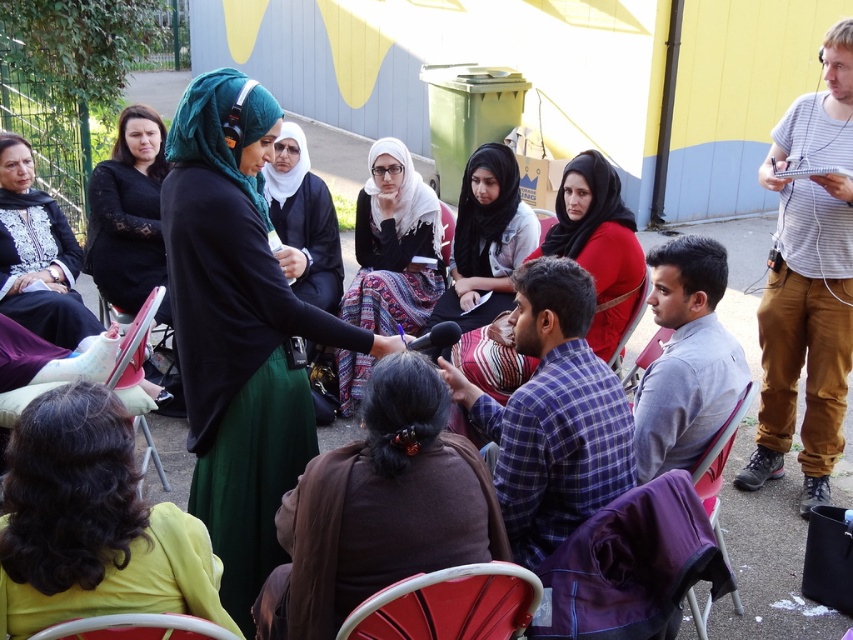
Is curly hair at lower left wider than red plastic chair at lower center?

Yes, curly hair at lower left is wider than red plastic chair at lower center.

Between point (112, 572) and point (373, 636), which one is positioned in front?

Point (112, 572)

This screenshot has width=853, height=640. In order to click on curly hair at lower left in this screenshot , I will do `click(91, 524)`.

Which is more to the left, black lace dress at center or plastic chair at lower left?

From the viewer's perspective, black lace dress at center appears more on the left side.

Is black lace dress at center wider than plastic chair at lower left?

Correct, the width of black lace dress at center exceeds that of plastic chair at lower left.

The image size is (853, 640). I want to click on black lace dress at center, so click(x=128, y=212).

Between patterned fabric hijab at center and red plastic chair at lower center, which one appears on the right side from the viewer's perspective?

red plastic chair at lower center

Is point (376, 243) closer to camera compared to point (366, 621)?

No, (376, 243) is behind (366, 621).

Is point (358, 195) positioned before point (439, 621)?

No, it is not.

You are a GUI agent. You are given a task and a screenshot of the screen. Output one action in this format:
    pyautogui.click(x=<x>, y=<y>)
    Task: Click on the patterned fabric hijab at center
    Image resolution: width=853 pixels, height=640 pixels.
    Given the screenshot: What is the action you would take?
    pyautogui.click(x=393, y=244)